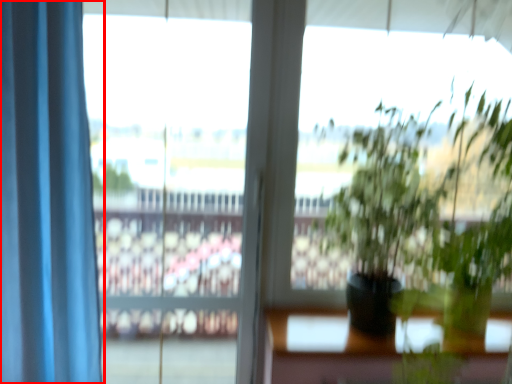
Question: Observing the image, what is the correct spatial positioning of curtain (annotated by the red box) in reference to window frame?

Choices:
 (A) left
 (B) right

Answer: (A)